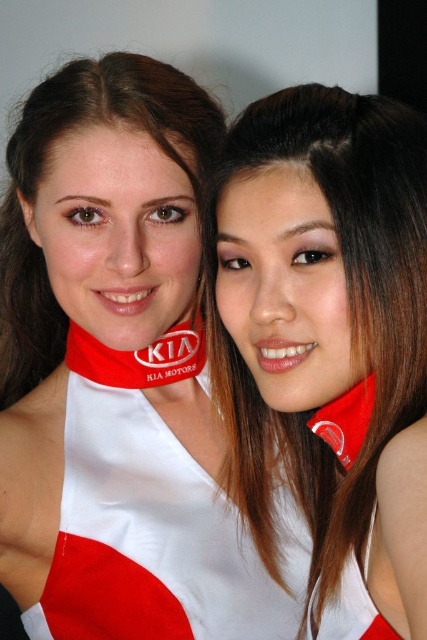
You are a photographer adjusting the lighting for a photo shoot. You notice the white matte necktie at center and the red fabric at center are 24.71 centimeters apart. If your camera has a minimum focus distance of 25 centimeters, will you need to adjust the camera position to ensure both items are in focus?

The white matte necktie at center and red fabric at center are 24.71 centimeters apart, which is less than the camera minimum focus distance of 25 centimeters. Therefore, you will need to adjust the camera position to ensure both items are in focus.

You are a photographer adjusting the lighting for a photo shoot. You notice two elements at the center of the image that might cast shadows. The elements are the white matte necktie at center and the red fabric at center. Which of these two items is more likely to cast a larger shadow?

The white matte necktie at center is larger in size than the red fabric at center, so it will cast a larger shadow.

You are a photographer adjusting the lighting for a photo shoot. You notice the white matte necktie at center and the red fabric at center. Which object should you focus on first if you want to ensure proper exposure for the one that is closer to the camera?

The white matte necktie at center is in front of the red fabric at center, so you should focus on the white matte necktie at center first to ensure proper exposure since it is closer to the camera.